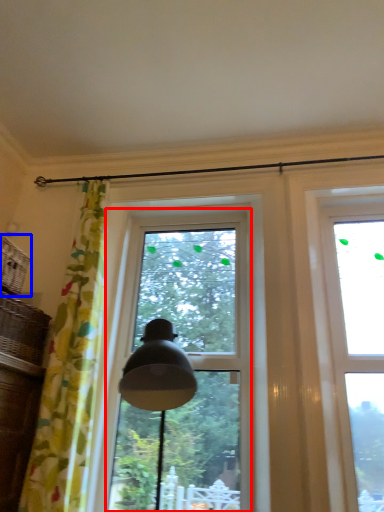
Question: Which object is further to the camera taking this photo, window (highlighted by a red box) or basket (highlighted by a blue box)?

Choices:
 (A) window
 (B) basket

Answer: (A)